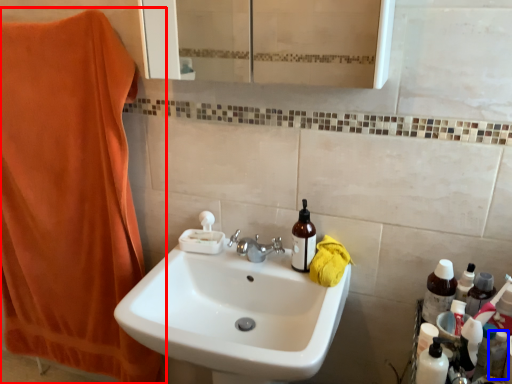
Question: Which point is further to the camera, beach towel (highlighted by a red box) or toiletry (highlighted by a blue box)?

Choices:
 (A) beach towel
 (B) toiletry

Answer: (A)